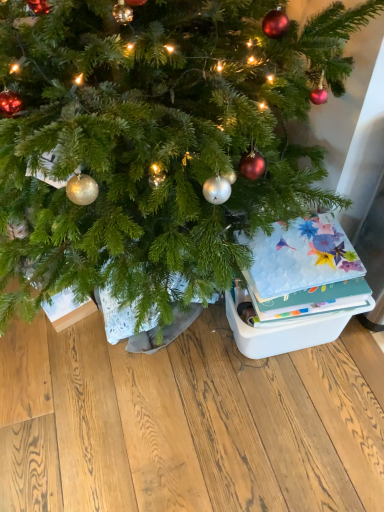
Question: Considering the relative sizes of white plastic storage box at lower right and green matte christmas tree at center in the image provided, is white plastic storage box at lower right thinner than green matte christmas tree at center?

Choices:
 (A) yes
 (B) no

Answer: (A)

Question: From the image's perspective, is white plastic storage box at lower right beneath green matte christmas tree at center?

Choices:
 (A) no
 (B) yes

Answer: (B)

Question: Would you say white plastic storage box at lower right is outside green matte christmas tree at center?

Choices:
 (A) no
 (B) yes

Answer: (B)

Question: Does white plastic storage box at lower right have a greater height compared to green matte christmas tree at center?

Choices:
 (A) yes
 (B) no

Answer: (A)

Question: From a real-world perspective, is white plastic storage box at lower right located higher than green matte christmas tree at center?

Choices:
 (A) no
 (B) yes

Answer: (B)

Question: Does white plastic storage box at lower right have a smaller size compared to green matte christmas tree at center?

Choices:
 (A) no
 (B) yes

Answer: (B)

Question: Considering the relative sizes of green matte christmas tree at center and white plastic storage box at lower right in the image provided, is green matte christmas tree at center smaller than white plastic storage box at lower right?

Choices:
 (A) no
 (B) yes

Answer: (A)

Question: Is green matte christmas tree at center thinner than white plastic storage box at lower right?

Choices:
 (A) yes
 (B) no

Answer: (B)

Question: Is green matte christmas tree at center oriented towards white plastic storage box at lower right?

Choices:
 (A) yes
 (B) no

Answer: (B)

Question: Are green matte christmas tree at center and white plastic storage box at lower right located far from each other?

Choices:
 (A) no
 (B) yes

Answer: (A)

Question: Is green matte christmas tree at center not inside white plastic storage box at lower right?

Choices:
 (A) no
 (B) yes

Answer: (B)

Question: Is green matte christmas tree at center at the right side of white plastic storage box at lower right?

Choices:
 (A) no
 (B) yes

Answer: (A)

Question: From the image's perspective, is floral-patterned paper at right located above white plastic storage box at lower right?

Choices:
 (A) no
 (B) yes

Answer: (B)